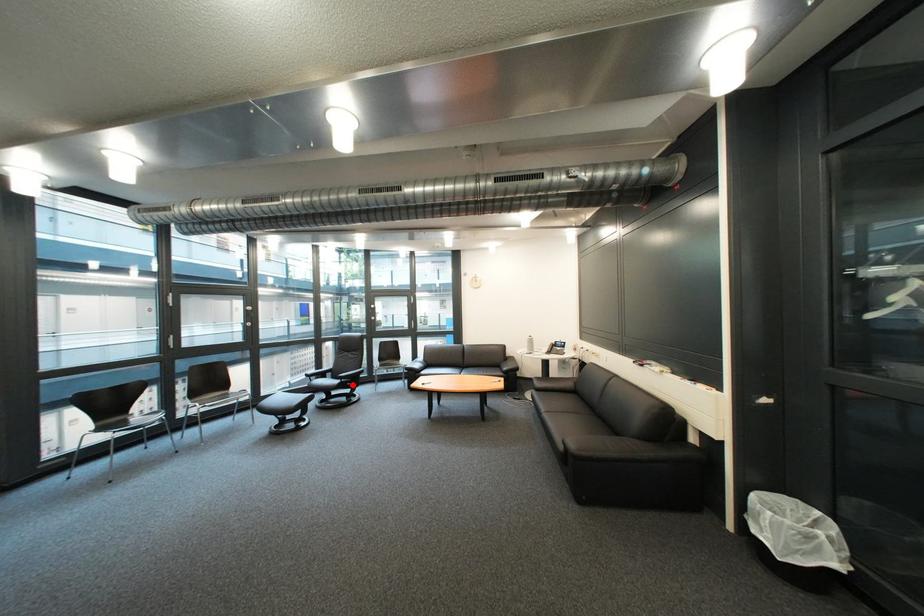
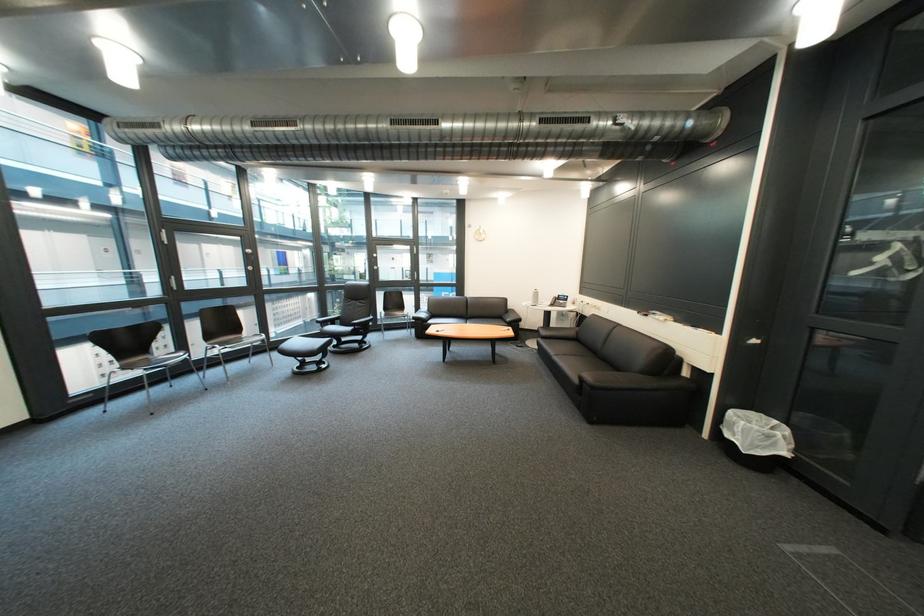
Question: A red point is marked in image1. In image2, is the corresponding 3D point closer to the camera or farther? Reply with the corresponding letter.

Choices:
 (A) The corresponding 3D point is closer.
 (B) The corresponding 3D point is farther.

Answer: (A)